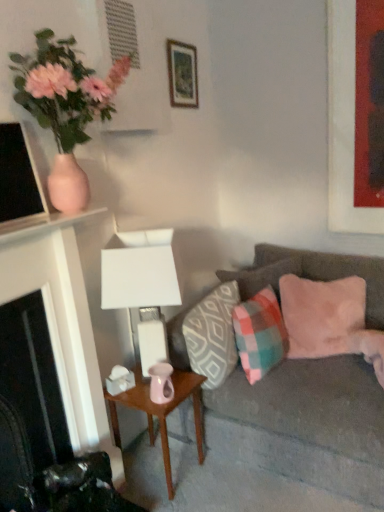
Question: Would you say pink matte vase at upper left is to the left or to the right of pink glossy vase at center in the picture?

Choices:
 (A) left
 (B) right

Answer: (A)

Question: Looking at the image, does pink matte vase at upper left seem bigger or smaller compared to pink glossy vase at center?

Choices:
 (A) big
 (B) small

Answer: (A)

Question: Estimate the real-world distances between objects in this image. Which object is farther from the wooden picture frame at upper center, the first picture frame positioned from the left?

Choices:
 (A) pink glossy vase at center
 (B) black matte fireplace at left
 (C) white matte table lamp at center
 (D) velvet gray couch at right
 (E) plaid fabric pillow at center right, the 3th pillow viewed from the right

Answer: (A)

Question: Which object is positioned farthest from the pink velvet cushion at right, placed as the first pillow when sorted from right to left?

Choices:
 (A) plaid fabric pillow at center right, the 3th pillow viewed from the right
 (B) velvet gray couch at right
 (C) white matte table lamp at center
 (D) black matte fireplace at left
 (E) pink glossy vase at center

Answer: (D)